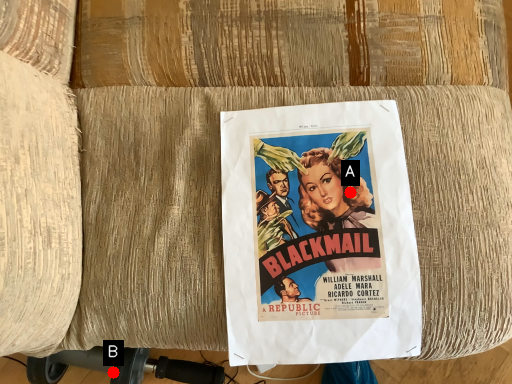
Question: Two points are circled on the image, labeled by A and B beside each circle. Which of the following is the farthest from the observer?

Choices:
 (A) A is further
 (B) B is further

Answer: (B)